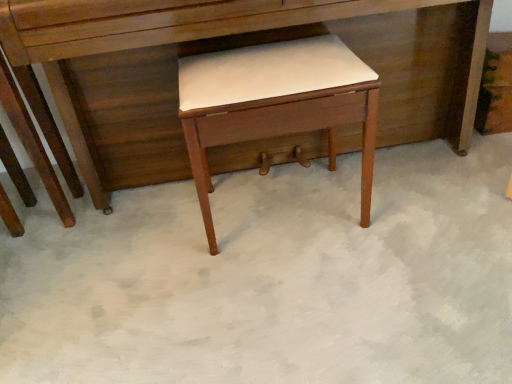
Where is `free region under matte wood stool at center (from a real-world perspective)`? free region under matte wood stool at center (from a real-world perspective) is located at coordinates (282, 221).